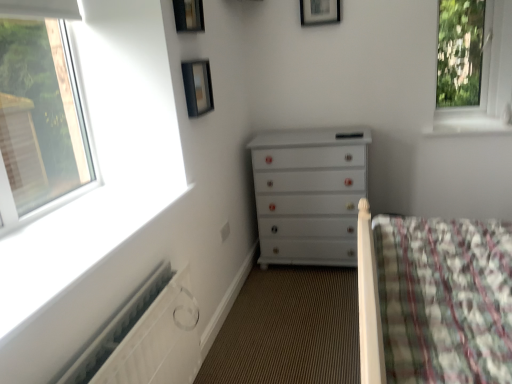
Question: Does white glossy window sill at upper right have a smaller size compared to black glass picture frame at upper center, positioned as the second picture frame in bottom-to-top order?

Choices:
 (A) yes
 (B) no

Answer: (B)

Question: Is black glass picture frame at upper center, positioned as the second picture frame in bottom-to-top order, at the back of white glossy window sill at upper right?

Choices:
 (A) yes
 (B) no

Answer: (B)

Question: Does white glossy window sill at upper right have a lesser width compared to black glass picture frame at upper center, marked as the third picture frame in a back-to-front arrangement?

Choices:
 (A) no
 (B) yes

Answer: (A)

Question: Would you say white glossy window sill at upper right is a long distance from black glass picture frame at upper center, the first picture frame viewed from the left?

Choices:
 (A) no
 (B) yes

Answer: (B)

Question: Is white glossy window sill at upper right directly adjacent to black glass picture frame at upper center, positioned as the second picture frame in bottom-to-top order?

Choices:
 (A) no
 (B) yes

Answer: (A)

Question: From a real-world perspective, is white glossy window sill at upper right positioned under black glass picture frame at upper center, marked as the third picture frame in a back-to-front arrangement, based on gravity?

Choices:
 (A) no
 (B) yes

Answer: (B)

Question: Is white glossy chest of drawers at center taller than black glass picture frame at upper center, which ranks as the 1th picture frame in front-to-back order?

Choices:
 (A) yes
 (B) no

Answer: (A)

Question: Can you confirm if white glossy chest of drawers at center is positioned to the right of black glass picture frame at upper center, marked as the third picture frame in a back-to-front arrangement?

Choices:
 (A) yes
 (B) no

Answer: (A)

Question: Considering the relative positions of white glossy chest of drawers at center and black glass picture frame at upper center, which ranks as the 1th picture frame in front-to-back order, in the image provided, is white glossy chest of drawers at center in front of black glass picture frame at upper center, which ranks as the 1th picture frame in front-to-back order,?

Choices:
 (A) yes
 (B) no

Answer: (B)

Question: Is white glossy chest of drawers at center not near black glass picture frame at upper center, marked as the third picture frame in a back-to-front arrangement?

Choices:
 (A) no
 (B) yes

Answer: (B)

Question: Is white glossy chest of drawers at center oriented towards black glass picture frame at upper center, marked as the second picture frame in a top-to-bottom arrangement?

Choices:
 (A) no
 (B) yes

Answer: (A)

Question: Considering the relative sizes of white glossy chest of drawers at center and black glass picture frame at upper center, the first picture frame viewed from the left, in the image provided, is white glossy chest of drawers at center bigger than black glass picture frame at upper center, the first picture frame viewed from the left,?

Choices:
 (A) no
 (B) yes

Answer: (B)

Question: Is black glass picture frame at upper center, positioned as the second picture frame in bottom-to-top order, at the left side of white glossy chest of drawers at center?

Choices:
 (A) yes
 (B) no

Answer: (A)